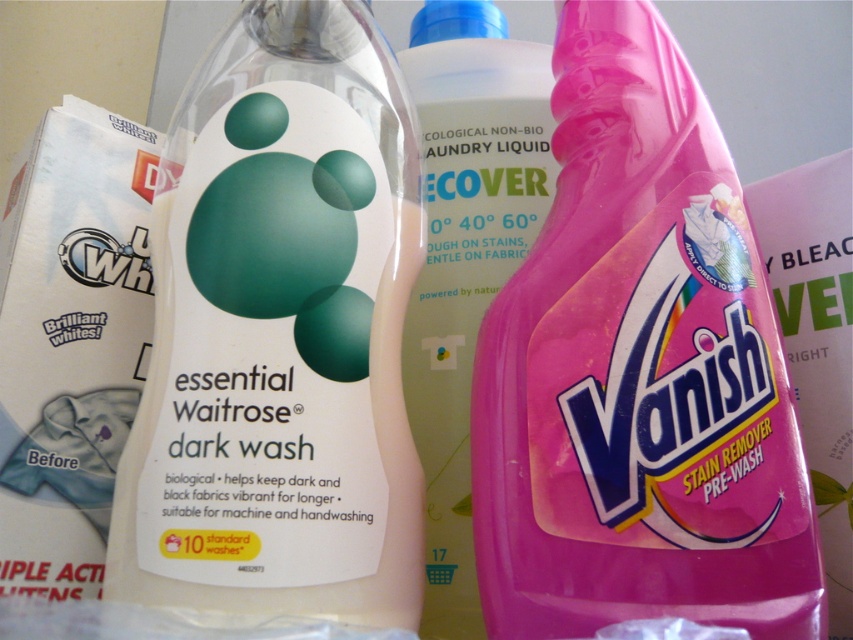
Who is more distant from viewer, (369, 522) or (444, 456)?

The point (444, 456) is more distant.

Is point (219, 60) more distant than point (544, 109)?

No.

Locate an element on the screen. The image size is (853, 640). white matte bottle at center is located at coordinates (280, 333).

Is pink plastic vanish stain remover at right bigger than white matte bottle at center?

Correct, pink plastic vanish stain remover at right is larger in size than white matte bottle at center.

Between pink plastic vanish stain remover at right and white matte bottle at center, which one is positioned higher?

white matte bottle at center is above.

Who is more distant from viewer, (602, 608) or (345, 124)?

The point (345, 124) is behind.

Where is `pink plastic vanish stain remover at right`? The image size is (853, 640). pink plastic vanish stain remover at right is located at coordinates (637, 372).

Can you confirm if pink plastic vanish stain remover at right is wider than translucent plastic bottle at center?

Yes, pink plastic vanish stain remover at right is wider than translucent plastic bottle at center.

Is point (611, 365) closer to viewer compared to point (456, 552)?

Yes, it is in front of point (456, 552).

You are a GUI agent. You are given a task and a screenshot of the screen. Output one action in this format:
    pyautogui.click(x=<x>, y=<y>)
    Task: Click on the pink plastic vanish stain remover at right
    This screenshot has height=640, width=853.
    Given the screenshot: What is the action you would take?
    pyautogui.click(x=637, y=372)